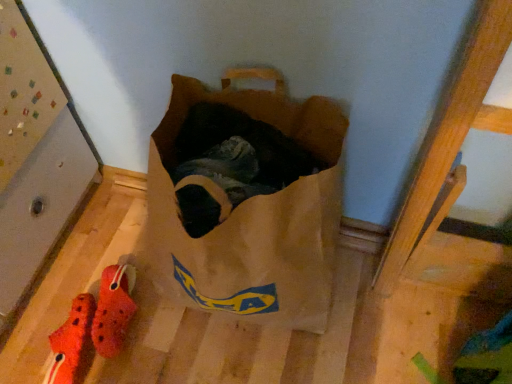
The width and height of the screenshot is (512, 384). Describe the element at coordinates (113, 309) in the screenshot. I see `rubberized red croc at lower left, arranged as the second footwear when viewed from the left` at that location.

Where is `rubberized red croc at lower left, arranged as the second footwear when viewed from the left`? The image size is (512, 384). rubberized red croc at lower left, arranged as the second footwear when viewed from the left is located at coordinates (113, 309).

The image size is (512, 384). What do you see at coordinates (72, 343) in the screenshot? I see `orange fabric slipper at lower left, acting as the second footwear starting from the right` at bounding box center [72, 343].

Where is `orange fabric slipper at lower left, the first footwear viewed from the left`? The height and width of the screenshot is (384, 512). orange fabric slipper at lower left, the first footwear viewed from the left is located at coordinates (72, 343).

The height and width of the screenshot is (384, 512). I want to click on rubberized red croc at lower left, positioned as the first footwear in right-to-left order, so click(x=113, y=309).

Can you confirm if rubberized red croc at lower left, arranged as the second footwear when viewed from the left, is positioned to the left of orange fabric slipper at lower left, the first footwear viewed from the left?

No, rubberized red croc at lower left, arranged as the second footwear when viewed from the left, is not to the left of orange fabric slipper at lower left, the first footwear viewed from the left.

Considering their positions, is rubberized red croc at lower left, arranged as the second footwear when viewed from the left, located in front of or behind orange fabric slipper at lower left, the first footwear viewed from the left?

Visually, rubberized red croc at lower left, arranged as the second footwear when viewed from the left, is located behind orange fabric slipper at lower left, the first footwear viewed from the left.

Based on the photo, which is nearer, (124, 332) or (87, 365)?

Point (124, 332).

From the image's perspective, which is above, rubberized red croc at lower left, positioned as the first footwear in right-to-left order, or orange fabric slipper at lower left, the first footwear viewed from the left?

rubberized red croc at lower left, positioned as the first footwear in right-to-left order, from the image's perspective.

From a real-world perspective, between rubberized red croc at lower left, arranged as the second footwear when viewed from the left, and orange fabric slipper at lower left, the first footwear viewed from the left, who is vertically higher?

rubberized red croc at lower left, arranged as the second footwear when viewed from the left.

Which of these two, rubberized red croc at lower left, arranged as the second footwear when viewed from the left, or orange fabric slipper at lower left, the first footwear viewed from the left, is wider?

With larger width is rubberized red croc at lower left, arranged as the second footwear when viewed from the left.

Who is shorter, rubberized red croc at lower left, positioned as the first footwear in right-to-left order, or orange fabric slipper at lower left, acting as the second footwear starting from the right?

rubberized red croc at lower left, positioned as the first footwear in right-to-left order.

Between rubberized red croc at lower left, arranged as the second footwear when viewed from the left, and orange fabric slipper at lower left, the first footwear viewed from the left, which one has larger size?

With larger size is orange fabric slipper at lower left, the first footwear viewed from the left.

Based on the photo, is rubberized red croc at lower left, positioned as the first footwear in right-to-left order, spatially inside orange fabric slipper at lower left, the first footwear viewed from the left, or outside of it?

rubberized red croc at lower left, positioned as the first footwear in right-to-left order, is not enclosed by orange fabric slipper at lower left, the first footwear viewed from the left.

From the picture: Is rubberized red croc at lower left, arranged as the second footwear when viewed from the left, beside orange fabric slipper at lower left, the first footwear viewed from the left?

Yes, rubberized red croc at lower left, arranged as the second footwear when viewed from the left, is touching orange fabric slipper at lower left, the first footwear viewed from the left.

Is rubberized red croc at lower left, arranged as the second footwear when viewed from the left, facing away from orange fabric slipper at lower left, acting as the second footwear starting from the right?

No.

How different are the orientations of rubberized red croc at lower left, positioned as the first footwear in right-to-left order, and orange fabric slipper at lower left, acting as the second footwear starting from the right, in degrees?

rubberized red croc at lower left, positioned as the first footwear in right-to-left order, and orange fabric slipper at lower left, acting as the second footwear starting from the right, are facing 5.09 degrees away from each other.

How distant is rubberized red croc at lower left, arranged as the second footwear when viewed from the left, from orange fabric slipper at lower left, the first footwear viewed from the left?

The distance of rubberized red croc at lower left, arranged as the second footwear when viewed from the left, from orange fabric slipper at lower left, the first footwear viewed from the left, is 2.14 inches.

Locate an element on the screen. Image resolution: width=512 pixels, height=384 pixels. footwear lying above the orange fabric slipper at lower left, acting as the second footwear starting from the right (from the image's perspective) is located at coordinates (113, 309).

Is orange fabric slipper at lower left, acting as the second footwear starting from the right, at the right side of rubberized red croc at lower left, arranged as the second footwear when viewed from the left?

No.

Between orange fabric slipper at lower left, the first footwear viewed from the left, and rubberized red croc at lower left, arranged as the second footwear when viewed from the left, which one is positioned in front?

orange fabric slipper at lower left, the first footwear viewed from the left, is in front.

Does point (79, 323) come farther from viewer compared to point (103, 307)?

No, (79, 323) is closer to viewer.

From the image's perspective, is orange fabric slipper at lower left, acting as the second footwear starting from the right, over rubberized red croc at lower left, arranged as the second footwear when viewed from the left?

No.

From a real-world perspective, is orange fabric slipper at lower left, acting as the second footwear starting from the right, beneath rubberized red croc at lower left, positioned as the first footwear in right-to-left order?

Yes, from a real-world perspective, orange fabric slipper at lower left, acting as the second footwear starting from the right, is below rubberized red croc at lower left, positioned as the first footwear in right-to-left order.

Looking at their sizes, would you say orange fabric slipper at lower left, acting as the second footwear starting from the right, is wider or thinner than rubberized red croc at lower left, arranged as the second footwear when viewed from the left?

In the image, orange fabric slipper at lower left, acting as the second footwear starting from the right, appears to be more narrow than rubberized red croc at lower left, arranged as the second footwear when viewed from the left.

Can you confirm if orange fabric slipper at lower left, the first footwear viewed from the left, is taller than rubberized red croc at lower left, positioned as the first footwear in right-to-left order?

Correct, orange fabric slipper at lower left, the first footwear viewed from the left, is much taller as rubberized red croc at lower left, positioned as the first footwear in right-to-left order.

Can you confirm if orange fabric slipper at lower left, acting as the second footwear starting from the right, is bigger than rubberized red croc at lower left, positioned as the first footwear in right-to-left order?

Yes, orange fabric slipper at lower left, acting as the second footwear starting from the right, is bigger than rubberized red croc at lower left, positioned as the first footwear in right-to-left order.

Can we say orange fabric slipper at lower left, acting as the second footwear starting from the right, lies outside rubberized red croc at lower left, arranged as the second footwear when viewed from the left?

Indeed, orange fabric slipper at lower left, acting as the second footwear starting from the right, is completely outside rubberized red croc at lower left, arranged as the second footwear when viewed from the left.

Are orange fabric slipper at lower left, acting as the second footwear starting from the right, and rubberized red croc at lower left, positioned as the first footwear in right-to-left order, beside each other?

Yes, orange fabric slipper at lower left, acting as the second footwear starting from the right, is touching rubberized red croc at lower left, positioned as the first footwear in right-to-left order.

Is rubberized red croc at lower left, positioned as the first footwear in right-to-left order, at the back of orange fabric slipper at lower left, acting as the second footwear starting from the right?

No, orange fabric slipper at lower left, acting as the second footwear starting from the right, is not facing the opposite direction of rubberized red croc at lower left, positioned as the first footwear in right-to-left order.

Where is `footwear lying on the right of orange fabric slipper at lower left, the first footwear viewed from the left`? This screenshot has height=384, width=512. footwear lying on the right of orange fabric slipper at lower left, the first footwear viewed from the left is located at coordinates (113, 309).

The width and height of the screenshot is (512, 384). I want to click on footwear on the right of the orange fabric slipper at lower left, acting as the second footwear starting from the right, so click(113, 309).

At what (x,y) coordinates should I click in order to perform the action: click on footwear beneath the rubberized red croc at lower left, positioned as the first footwear in right-to-left order (from a real-world perspective). Please return your answer as a coordinate pair (x, y). The height and width of the screenshot is (384, 512). Looking at the image, I should click on (72, 343).